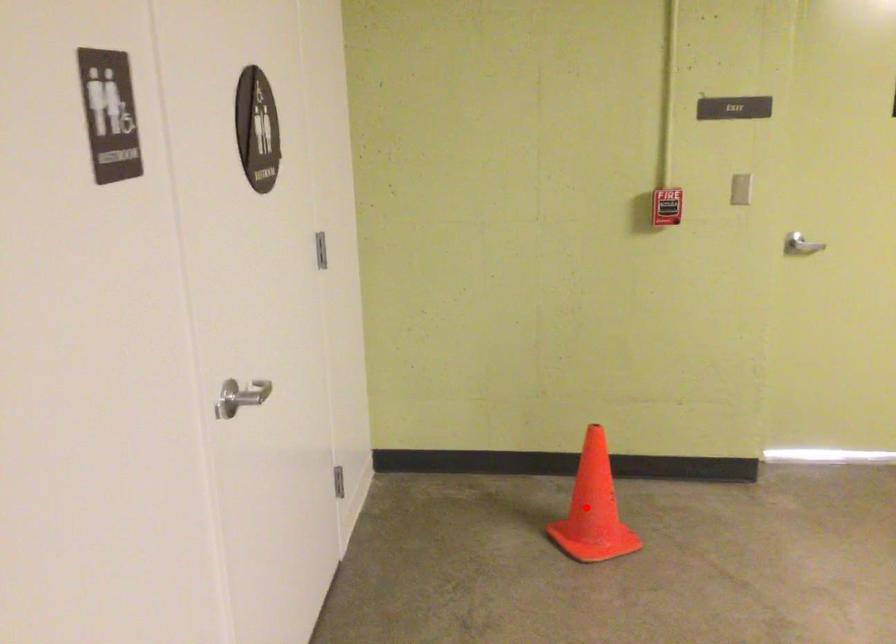
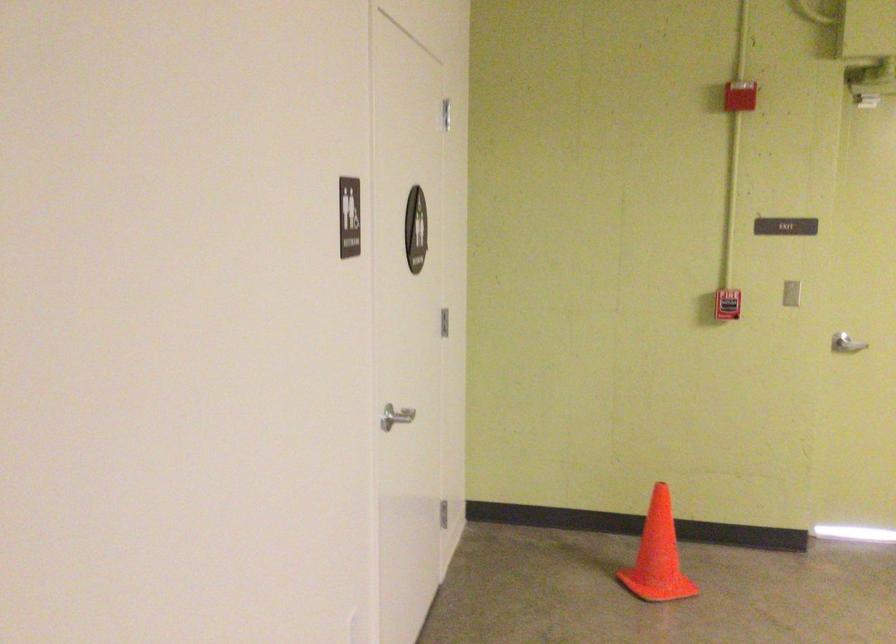
Where in the second image is the point corresponding to the highlighted location from the first image?

(658, 556)